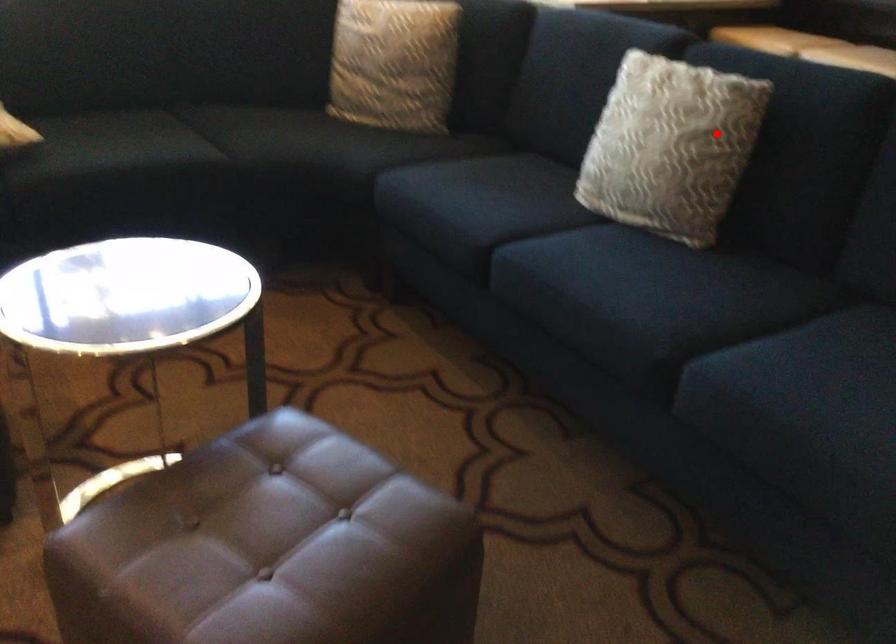
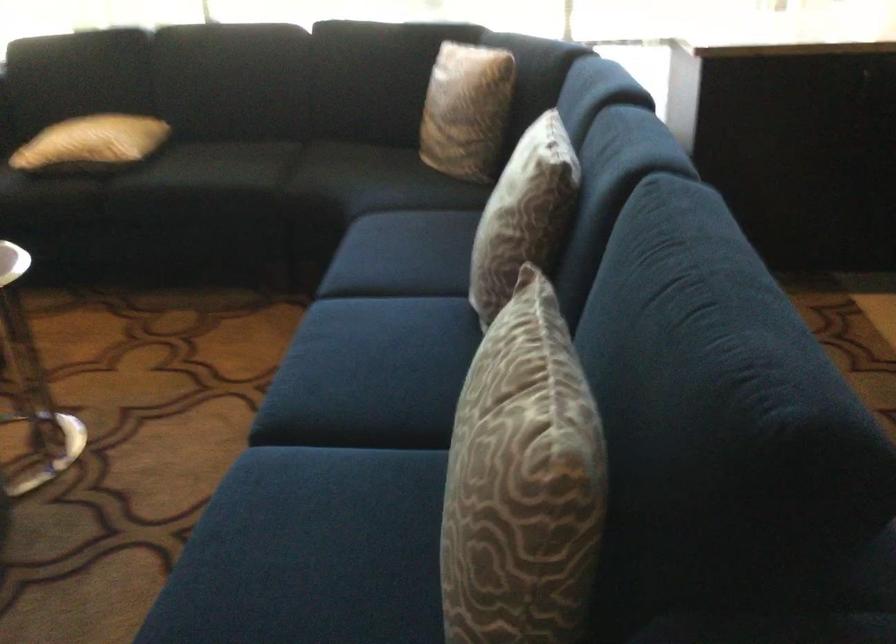
Where in the second image is the point corresponding to the highlighted location from the first image?

(523, 213)